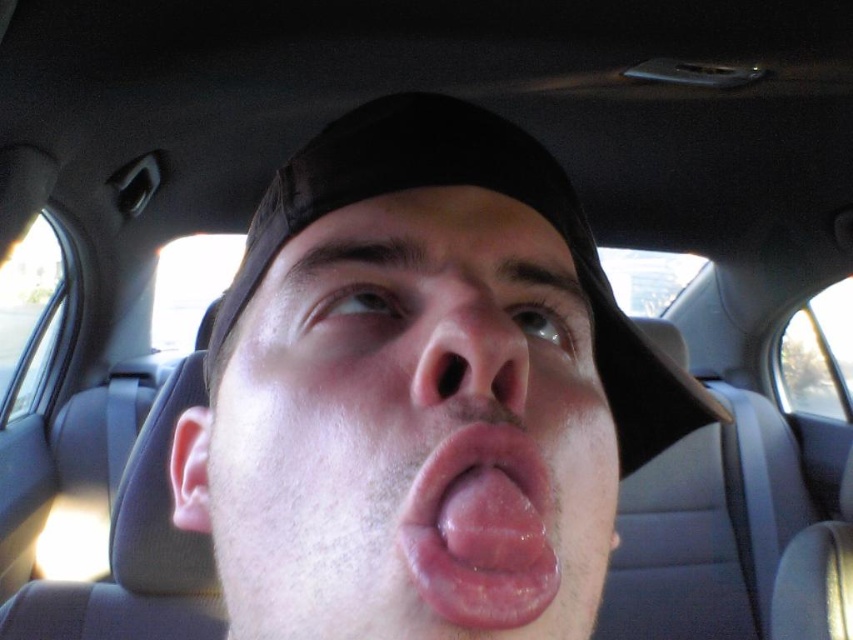
Question: Observing the image, what is the correct spatial positioning of smooth skin face at center in reference to black fabric baseball hat at center?

Choices:
 (A) right
 (B) left

Answer: (B)

Question: Among these objects, which one is nearest to the camera?

Choices:
 (A) pink smooth tongue at center
 (B) smooth skin face at center
 (C) black fabric baseball hat at center
 (D) smooth skin nose at center

Answer: (B)

Question: Which of these objects is positioned farthest from the black fabric baseball hat at center?

Choices:
 (A) smooth skin face at center
 (B) smooth skin nose at center
 (C) pink smooth tongue at center

Answer: (C)

Question: Which object is farther from the camera taking this photo?

Choices:
 (A) smooth skin face at center
 (B) smooth skin nose at center
 (C) black fabric baseball hat at center
 (D) pink smooth tongue at center

Answer: (C)

Question: Does smooth skin face at center appear over black fabric baseball hat at center?

Choices:
 (A) yes
 (B) no

Answer: (B)

Question: Can you confirm if black fabric baseball hat at center is smaller than pink smooth tongue at center?

Choices:
 (A) no
 (B) yes

Answer: (A)